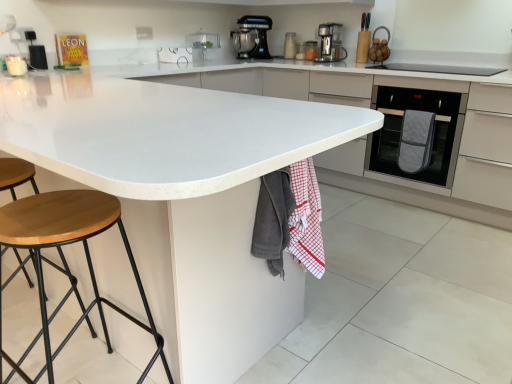
Question: Is red checkered towel at lower center, positioned as the 2th blanket in right-to-left order, taller than wooden seat stool at lower left?

Choices:
 (A) no
 (B) yes

Answer: (A)

Question: Is red checkered towel at lower center, positioned as the 2th blanket in right-to-left order, directly adjacent to wooden seat stool at lower left?

Choices:
 (A) no
 (B) yes

Answer: (A)

Question: From a real-world perspective, is red checkered towel at lower center, the second blanket viewed from the left, on wooden seat stool at lower left?

Choices:
 (A) yes
 (B) no

Answer: (A)

Question: From the image's perspective, would you say red checkered towel at lower center, the second blanket viewed from the left, is shown under wooden seat stool at lower left?

Choices:
 (A) yes
 (B) no

Answer: (B)

Question: Considering the relative positions of red checkered towel at lower center, positioned as the 2th blanket in right-to-left order, and wooden seat stool at lower left in the image provided, is red checkered towel at lower center, positioned as the 2th blanket in right-to-left order, to the left of wooden seat stool at lower left from the viewer's perspective?

Choices:
 (A) no
 (B) yes

Answer: (A)

Question: Would you say quilted gray oven mitt at right is to the left or to the right of matte glass jars at upper center, marked as the second appliance in a left-to-right arrangement, in the picture?

Choices:
 (A) right
 (B) left

Answer: (A)

Question: From the image's perspective, is quilted gray oven mitt at right located above or below matte glass jars at upper center, which is the 4th appliance in front-to-back order?

Choices:
 (A) below
 (B) above

Answer: (A)

Question: In terms of size, does quilted gray oven mitt at right appear bigger or smaller than matte glass jars at upper center, the 3th appliance positioned from the right?

Choices:
 (A) big
 (B) small

Answer: (A)

Question: Is quilted gray oven mitt at right situated inside matte glass jars at upper center, placed as the first appliance when sorted from back to front, or outside?

Choices:
 (A) outside
 (B) inside

Answer: (A)

Question: Based on their positions, is matte glass jars at upper center, the 3th appliance positioned from the right, located to the left or right of gray cotton towel at lower center, the 3th blanket in the right-to-left sequence?

Choices:
 (A) right
 (B) left

Answer: (A)

Question: Based on their sizes in the image, would you say matte glass jars at upper center, marked as the second appliance in a left-to-right arrangement, is bigger or smaller than gray cotton towel at lower center, which appears as the 1th blanket when viewed from the front?

Choices:
 (A) big
 (B) small

Answer: (B)

Question: Considering the positions of point (290, 46) and point (258, 236), is point (290, 46) closer or farther from the camera than point (258, 236)?

Choices:
 (A) farther
 (B) closer

Answer: (A)

Question: Is matte glass jars at upper center, placed as the first appliance when sorted from back to front, in front of or behind gray cotton towel at lower center, the 3th blanket in the right-to-left sequence, in the image?

Choices:
 (A) front
 (B) behind

Answer: (B)

Question: From a real-world perspective, relative to translucent glass jar at upper center, which is the 2th appliance from back to front, is gray cotton towel at lower center, the 1th blanket viewed from the left, vertically above or below?

Choices:
 (A) below
 (B) above

Answer: (A)

Question: From the image's perspective, is gray cotton towel at lower center, the 1th blanket viewed from the left, above or below translucent glass jar at upper center, which ranks as the 3th appliance in front-to-back order?

Choices:
 (A) below
 (B) above

Answer: (A)